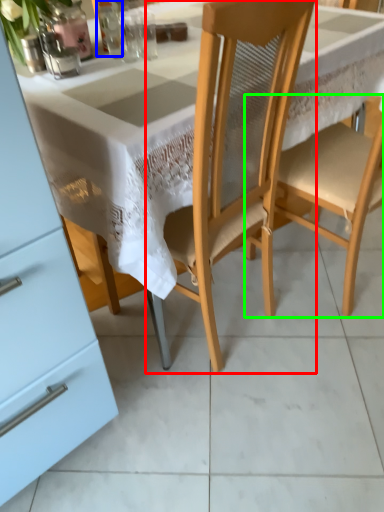
Question: Which object is the farthest from chair (highlighted by a red box)? Choose among these: tableware (highlighted by a blue box) or chair (highlighted by a green box).

Choices:
 (A) tableware
 (B) chair

Answer: (A)